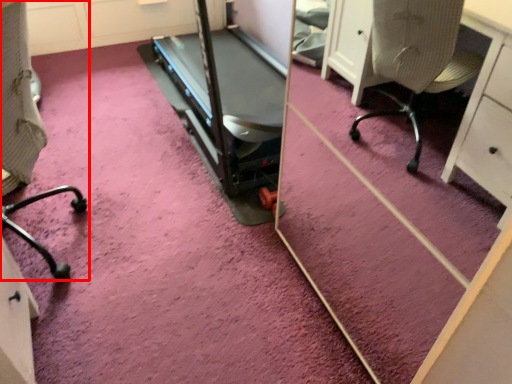
Question: From the image's perspective, what is the correct spatial positioning of furniture (annotated by the red box) in reference to treadmill?

Choices:
 (A) above
 (B) below

Answer: (B)